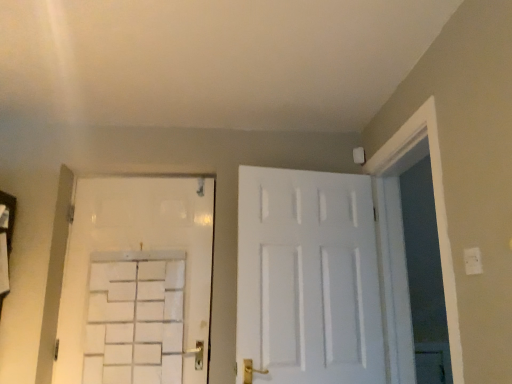
Based on the photo, measure the distance between white plastic electric outlet at upper right and camera.

white plastic electric outlet at upper right is 4.26 feet away from camera.

Measure the distance between point (x=149, y=312) and camera.

Point (x=149, y=312) and camera are 7.81 feet apart from each other.

The image size is (512, 384). I want to click on white matte door at center, which is the 2th door from left to right, so click(307, 278).

Does white plastic electric outlet at upper right come in front of white matte door at center, positioned as the 1th door in right-to-left order?

Yes, white plastic electric outlet at upper right is closer to the viewer.

Is point (473, 271) positioned in front of point (303, 374)?

Yes, point (473, 271) is in front of point (303, 374).

Who is smaller, white plastic electric outlet at upper right or white matte door at center, positioned as the 1th door in right-to-left order?

Smaller between the two is white plastic electric outlet at upper right.

Is white plastic electric outlet at upper right turned away from white matte door at upper left, positioned as the first door in left-to-right order?

That's not correct — white plastic electric outlet at upper right is not looking away from white matte door at upper left, positioned as the first door in left-to-right order.

Is point (467, 258) positioned before point (121, 278)?

Yes, it is.

From the image's perspective, is white plastic electric outlet at upper right positioned above or below white matte door at upper left, which is counted as the 2th door, starting from the right?

From the image's perspective, white plastic electric outlet at upper right appears above white matte door at upper left, which is counted as the 2th door, starting from the right.

From a real-world perspective, is white plastic electric outlet at upper right above or below white matte door at upper left, positioned as the first door in left-to-right order?

From a real-world perspective, white plastic electric outlet at upper right is physically below white matte door at upper left, positioned as the first door in left-to-right order.

In the scene shown: Does white matte door at upper left, which is counted as the 2th door, starting from the right, have a greater width compared to white plastic electric outlet at upper right?

Indeed, white matte door at upper left, which is counted as the 2th door, starting from the right, has a greater width compared to white plastic electric outlet at upper right.

How many degrees apart are the facing directions of white matte door at upper left, positioned as the first door in left-to-right order, and white plastic electric outlet at upper right?

The angular difference between white matte door at upper left, positioned as the first door in left-to-right order, and white plastic electric outlet at upper right is 87 degrees.

Is white matte door at upper left, positioned as the first door in left-to-right order, to the right of white plastic electric outlet at upper right from the viewer's perspective?

No.

Considering the positions of points (355, 301) and (465, 256), is point (355, 301) closer to camera compared to point (465, 256)?

No, it is not.

From a real-world perspective, who is located lower, white matte door at center, which is the 2th door from left to right, or white plastic electric outlet at upper right?

→ white plastic electric outlet at upper right is physically lower.

Is white matte door at center, which is the 2th door from left to right, turned away from white plastic electric outlet at upper right?

No.

Between white matte door at center, positioned as the 1th door in right-to-left order, and white plastic electric outlet at upper right, which one appears on the left side from the viewer's perspective?

white matte door at center, positioned as the 1th door in right-to-left order.

Does white matte door at center, positioned as the 1th door in right-to-left order, appear on the right side of white matte door at upper left, which is counted as the 2th door, starting from the right?

Correct, you'll find white matte door at center, positioned as the 1th door in right-to-left order, to the right of white matte door at upper left, which is counted as the 2th door, starting from the right.

At what (x,y) coordinates should I click in order to perform the action: click on door above the white matte door at center, which is the 2th door from left to right (from a real-world perspective). Please return your answer as a coordinate pair (x, y). The width and height of the screenshot is (512, 384). Looking at the image, I should click on (136, 281).

Is white matte door at center, which is the 2th door from left to right, turned away from white matte door at upper left, which is counted as the 2th door, starting from the right?

white matte door at center, which is the 2th door from left to right, does not have its back to white matte door at upper left, which is counted as the 2th door, starting from the right.

Relative to white matte door at upper left, which is counted as the 2th door, starting from the right, is white matte door at center, which is the 2th door from left to right, in front or behind?

Clearly, white matte door at center, which is the 2th door from left to right, is in front of white matte door at upper left, which is counted as the 2th door, starting from the right.

In the image, there is a white matte door at upper left, positioned as the first door in left-to-right order. Identify the location of door below it (from a real-world perspective). (307, 278).

From the image's perspective, is white matte door at upper left, positioned as the first door in left-to-right order, on top of white matte door at center, which is the 2th door from left to right?

Incorrect, from the image's perspective, white matte door at upper left, positioned as the first door in left-to-right order, is lower than white matte door at center, which is the 2th door from left to right.

Between white matte door at upper left, which is counted as the 2th door, starting from the right, and white matte door at center, positioned as the 1th door in right-to-left order, which one is positioned in front?

white matte door at center, positioned as the 1th door in right-to-left order, is more forward.

Measure the distance between white matte door at upper left, positioned as the first door in left-to-right order, and white matte door at center, positioned as the 1th door in right-to-left order.

They are 27.21 inches apart.

From the image's perspective, starting from the white plastic electric outlet at upper right, which door is the 1st one below? Please provide its 2D coordinates.

[(307, 278)]

Which door is the 2nd one when counting from the left side of the white plastic electric outlet at upper right? Please provide its 2D coordinates.

[(136, 281)]

Looking at the image, which one is located further to white plastic electric outlet at upper right, white matte door at center, which is the 2th door from left to right, or white matte door at upper left, which is counted as the 2th door, starting from the right?

Among the two, white matte door at upper left, which is counted as the 2th door, starting from the right, is located further to white plastic electric outlet at upper right.

Looking at the image, which one is located closer to white matte door at upper left, which is counted as the 2th door, starting from the right, white matte door at center, which is the 2th door from left to right, or white plastic electric outlet at upper right?

white matte door at center, which is the 2th door from left to right, is closer to white matte door at upper left, which is counted as the 2th door, starting from the right.

Estimate the real-world distances between objects in this image. Which object is closer to white plastic electric outlet at upper right, white matte door at upper left, positioned as the first door in left-to-right order, or white matte door at center, positioned as the 1th door in right-to-left order?

white matte door at center, positioned as the 1th door in right-to-left order, is positioned closer to the anchor white plastic electric outlet at upper right.

When comparing their distances from white matte door at center, positioned as the 1th door in right-to-left order, does white plastic electric outlet at upper right or white matte door at upper left, which is counted as the 2th door, starting from the right, seem further?

Based on the image, white plastic electric outlet at upper right appears to be further to white matte door at center, positioned as the 1th door in right-to-left order.

When comparing their distances from white matte door at upper left, which is counted as the 2th door, starting from the right, does white plastic electric outlet at upper right or white matte door at center, positioned as the 1th door in right-to-left order, seem further?

white plastic electric outlet at upper right.

Estimate the real-world distances between objects in this image. Which object is further from white matte door at center, positioned as the 1th door in right-to-left order, white matte door at upper left, which is counted as the 2th door, starting from the right, or white plastic electric outlet at upper right?

The object further to white matte door at center, positioned as the 1th door in right-to-left order, is white plastic electric outlet at upper right.

Where is `door between white matte door at upper left, positioned as the first door in left-to-right order, and white plastic electric outlet at upper right from left to right`? This screenshot has height=384, width=512. door between white matte door at upper left, positioned as the first door in left-to-right order, and white plastic electric outlet at upper right from left to right is located at coordinates (307, 278).